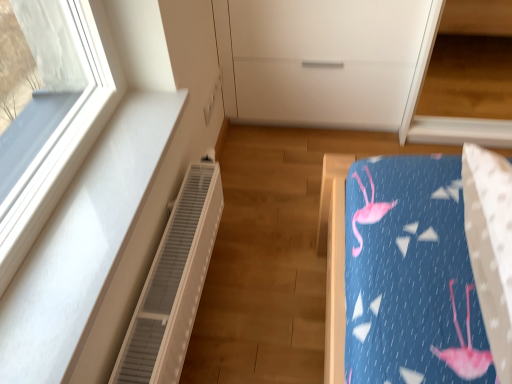
At what (x,y) coordinates should I click in order to perform the action: click on white plastic radiator at left. Please return your answer as a coordinate pair (x, y). Image resolution: width=512 pixels, height=384 pixels. Looking at the image, I should click on (173, 284).

Image resolution: width=512 pixels, height=384 pixels. Describe the element at coordinates (173, 284) in the screenshot. I see `white plastic radiator at left` at that location.

This screenshot has height=384, width=512. Describe the element at coordinates (325, 60) in the screenshot. I see `white matte dresser at upper center` at that location.

The width and height of the screenshot is (512, 384). I want to click on white matte dresser at upper center, so click(x=325, y=60).

Locate an element on the screen. This screenshot has width=512, height=384. white plastic radiator at left is located at coordinates (173, 284).

Which object is positioned more to the left, white plastic radiator at left or white matte dresser at upper center?

white plastic radiator at left.

Between white plastic radiator at left and white matte dresser at upper center, which one is positioned in front?

Positioned in front is white plastic radiator at left.

Considering the points (198, 181) and (405, 2), which point is in front, point (198, 181) or point (405, 2)?

Positioned in front is point (198, 181).

From the image's perspective, is white plastic radiator at left on white matte dresser at upper center?

Actually, white plastic radiator at left appears below white matte dresser at upper center in the image.

From a real-world perspective, does white plastic radiator at left stand above white matte dresser at upper center?

Actually, white plastic radiator at left is physically below white matte dresser at upper center in the real world.

Between white plastic radiator at left and white matte dresser at upper center, which one has smaller width?

Thinner between the two is white plastic radiator at left.

From their relative heights in the image, would you say white plastic radiator at left is taller or shorter than white matte dresser at upper center?

Considering their sizes, white plastic radiator at left has less height than white matte dresser at upper center.

Which of these two, white plastic radiator at left or white matte dresser at upper center, is bigger?

white matte dresser at upper center.

Is white plastic radiator at left outside of white matte dresser at upper center?

That's correct, white plastic radiator at left is outside of white matte dresser at upper center.

Based on the photo, can you see white plastic radiator at left touching white matte dresser at upper center?

No, white plastic radiator at left is not next to white matte dresser at upper center.

Could you tell me if white plastic radiator at left is facing white matte dresser at upper center?

No, white plastic radiator at left is not aimed at white matte dresser at upper center.

Where is `dresser lying on the right of white plastic radiator at left`? dresser lying on the right of white plastic radiator at left is located at coordinates (325, 60).

Is white matte dresser at upper center to the left of white plastic radiator at left from the viewer's perspective?

Incorrect, white matte dresser at upper center is not on the left side of white plastic radiator at left.

Does white matte dresser at upper center lie behind white plastic radiator at left?

Yes, white matte dresser at upper center is further from the viewer.

Considering the points (359, 87) and (176, 264), which point is behind, point (359, 87) or point (176, 264)?

The point (359, 87) is farther from the camera.

From the image's perspective, which is above, white matte dresser at upper center or white plastic radiator at left?

white matte dresser at upper center.

From a real-world perspective, is white matte dresser at upper center positioned above or below white plastic radiator at left?

white matte dresser at upper center is above white plastic radiator at left.

Considering the sizes of objects white matte dresser at upper center and white plastic radiator at left in the image provided, who is wider, white matte dresser at upper center or white plastic radiator at left?

white matte dresser at upper center is wider.

Who is shorter, white matte dresser at upper center or white plastic radiator at left?

Standing shorter between the two is white plastic radiator at left.

In the scene shown: Between white matte dresser at upper center and white plastic radiator at left, which one has smaller size?

white plastic radiator at left is smaller.

Is white matte dresser at upper center not inside white plastic radiator at left?

Indeed, white matte dresser at upper center is completely outside white plastic radiator at left.

Are white matte dresser at upper center and white plastic radiator at left making contact?

They are not placed beside each other.

Is white matte dresser at upper center oriented away from white plastic radiator at left?

No, white plastic radiator at left is not at the back of white matte dresser at upper center.

How different are the orientations of white matte dresser at upper center and white plastic radiator at left in degrees?

89.7 degrees separate the facing orientations of white matte dresser at upper center and white plastic radiator at left.

Based on the photo, how far apart are white matte dresser at upper center and white plastic radiator at left?

A distance of 32.92 inches exists between white matte dresser at upper center and white plastic radiator at left.

The image size is (512, 384). Find the location of `dresser above the white plastic radiator at left (from a real-world perspective)`. dresser above the white plastic radiator at left (from a real-world perspective) is located at coordinates (325, 60).

The height and width of the screenshot is (384, 512). I want to click on dresser behind the white plastic radiator at left, so click(325, 60).

What are the coordinates of `air conditioner in front of the white matte dresser at upper center` in the screenshot? It's located at (173, 284).